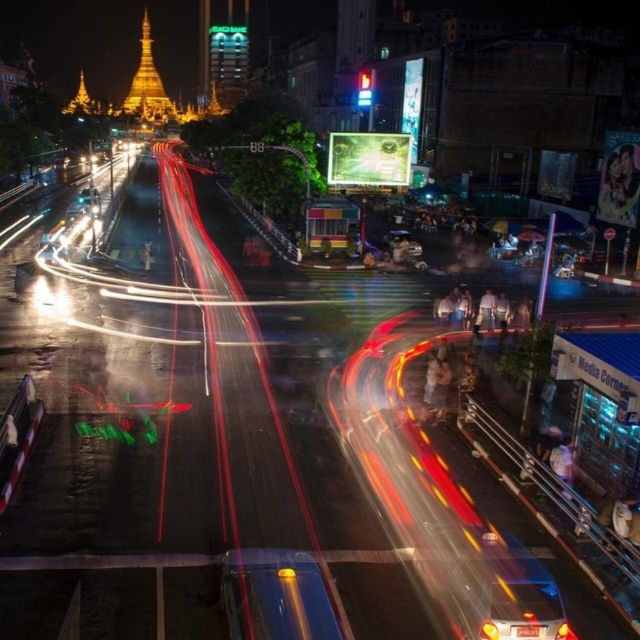
You are a delivery person needing to park your vehicle in a narrow alley that can only accommodate cars up to 1.8 meters in width. You see the metallic blue car at lower right and the shiny blue car at center. Which car should you choose to park in the alley without risking damage?

The shiny blue car at center is narrower than the metallic blue car at lower right, so you should choose the shiny blue car at center to park in the alley since it is within the 1.8 meters width limit.